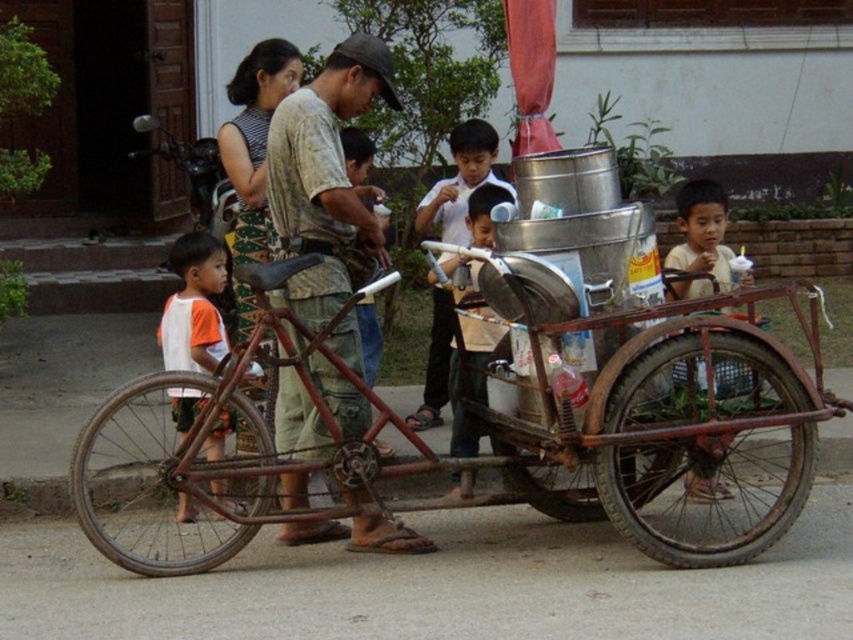
You are a delivery person who needs to load a package onto the rusty metal bicycle at center. The package is placed on the white cotton shirt at left. Can you reach the bicycle from your current position without moving the shirt?

The rusty metal bicycle at center is located above the white cotton shirt at left, so you can reach the bicycle by lifting the package from the shirt since it is positioned directly beneath it.

You are standing in the street scene and want to know which of the two points, point 1 at coordinates point (204, 516) or point 2 at coordinates point (706, 198), is closer to you. Can you determine which one is nearer?

Point 1 at coordinates point (204, 516) is closer to you than point 2 at coordinates point (706, 198).